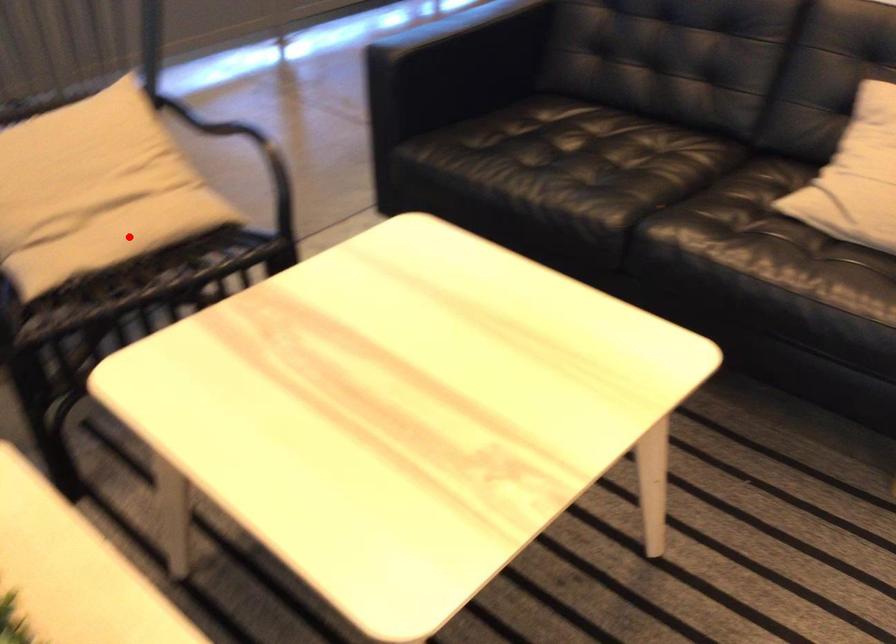
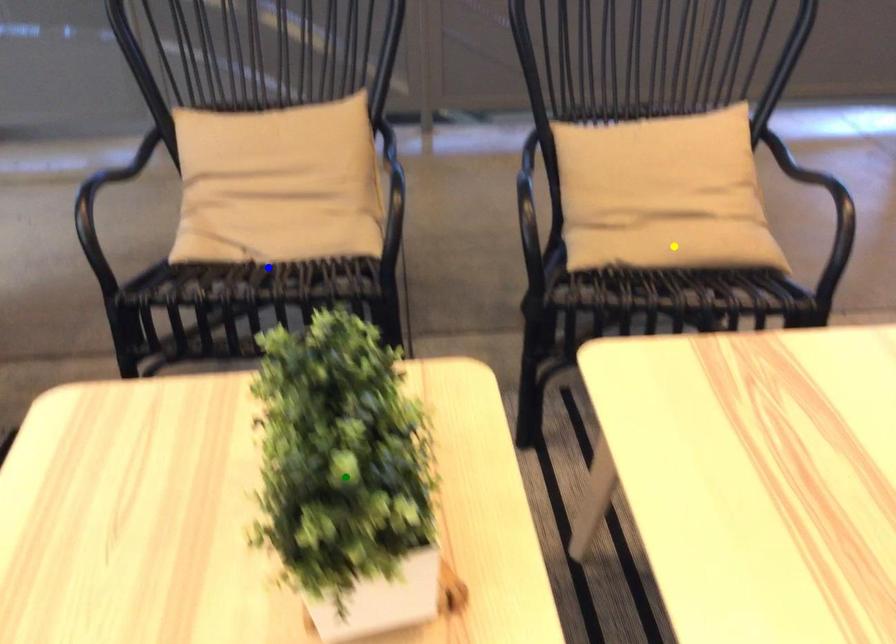
Question: I am providing you with two images of the same scene from different viewpoints. A red point is marked on the first image. You are given multiple points on the second image. Which point in image 2 represents the same 3d spot as the red point in image 1?

Choices:
 (A) yellow point
 (B) blue point
 (C) green point

Answer: (A)